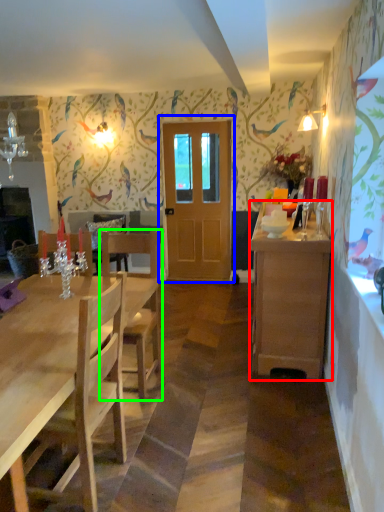
Question: Which object is the farthest from cabinetry (highlighted by a red box)? Choose among these: door (highlighted by a blue box) or chair (highlighted by a green box).

Choices:
 (A) door
 (B) chair

Answer: (A)